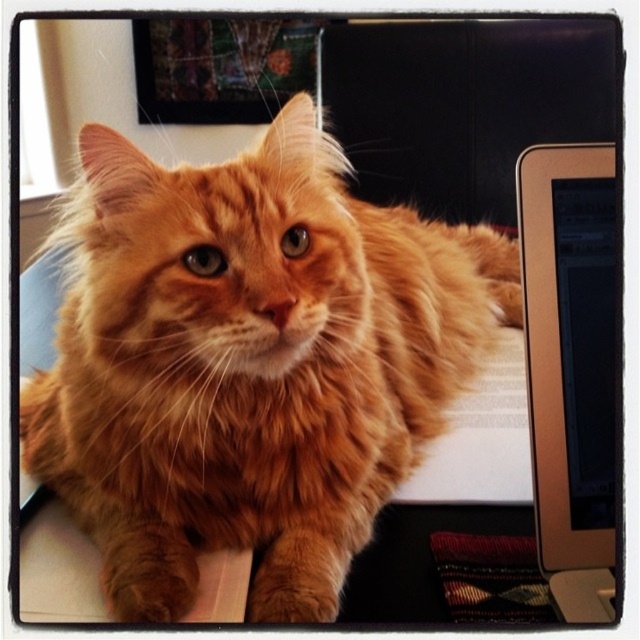
Question: Can you confirm if orange fluffy cat at center is positioned above metallic silver monitor at right?

Choices:
 (A) no
 (B) yes

Answer: (B)

Question: Can you confirm if orange fluffy cat at center is positioned above metallic silver monitor at right?

Choices:
 (A) yes
 (B) no

Answer: (A)

Question: Which point is farther to the camera?

Choices:
 (A) (132, 586)
 (B) (595, 163)

Answer: (A)

Question: Does orange fluffy cat at center have a larger size compared to metallic silver monitor at right?

Choices:
 (A) no
 (B) yes

Answer: (B)

Question: Which of the following is the farthest from the observer?

Choices:
 (A) metallic silver monitor at right
 (B) orange fluffy cat at center

Answer: (B)